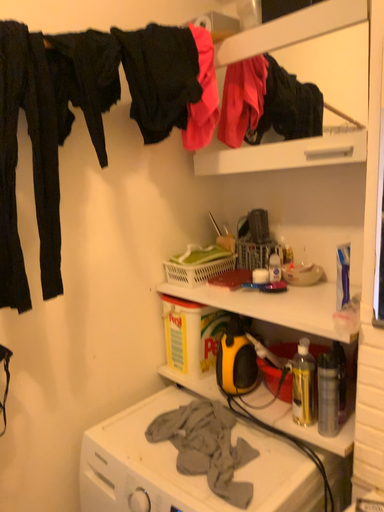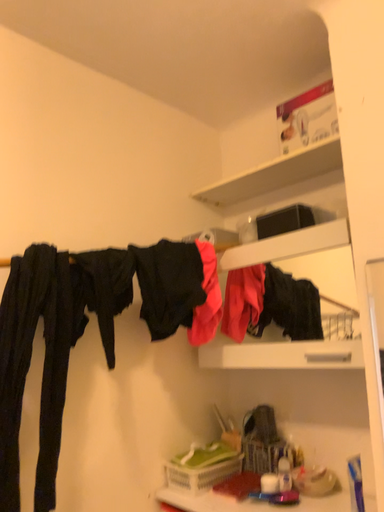
Question: How did the camera likely rotate when shooting the video?

Choices:
 (A) rotated downward
 (B) rotated upward

Answer: (B)